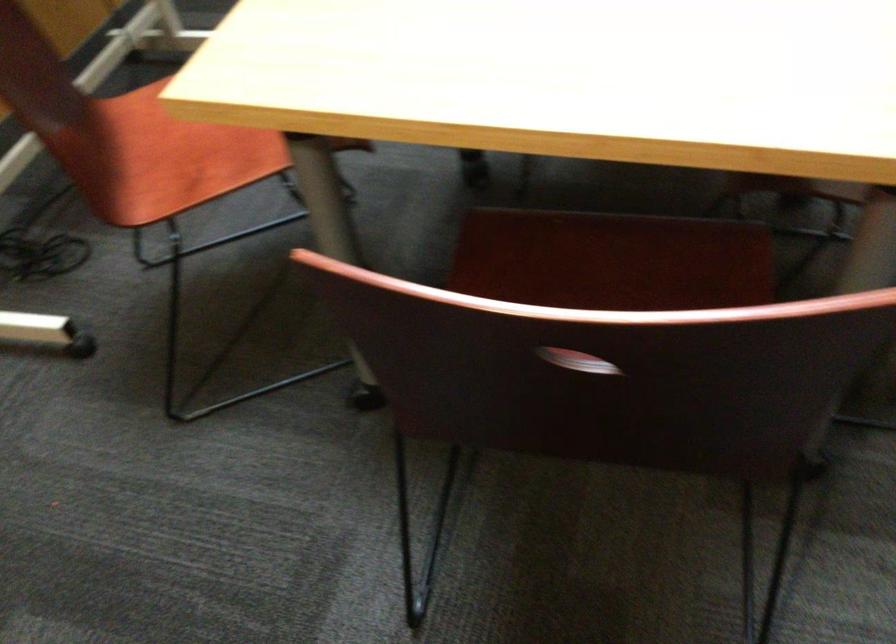
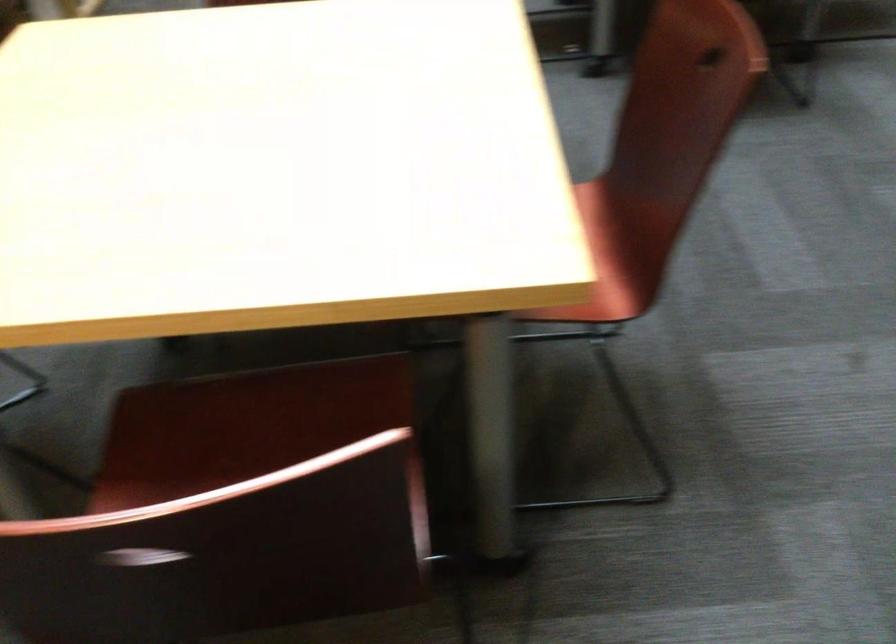
In a continuous first-person perspective shot, in which direction is the camera moving?

The cameraman moved toward right, backward.